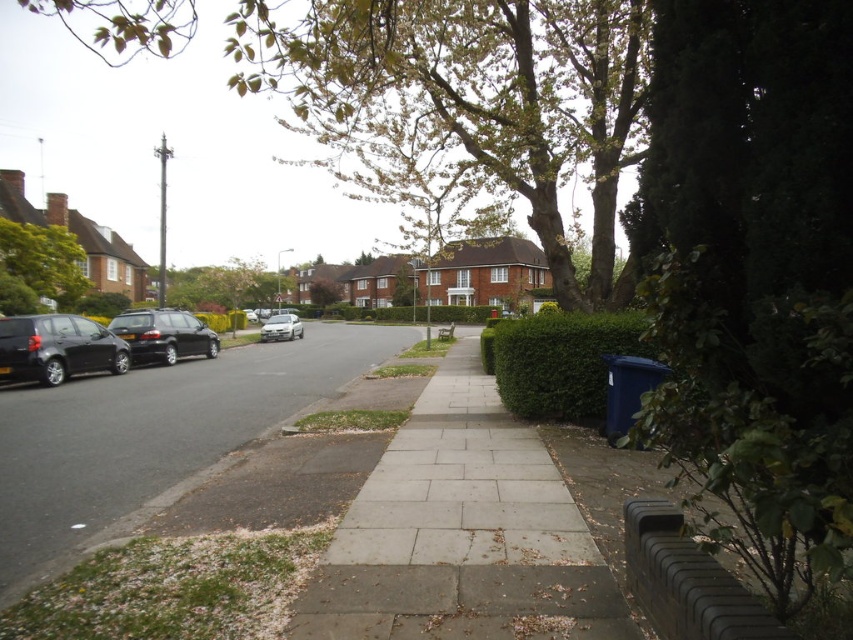
You are a delivery drone flying above a residential street. You need to land on the sidewalk near the green leafy tree at upper center. What are the coordinates where you should aim to land?

The green leafy tree at upper center is located at coordinates point (x=463, y=108), so you should aim to land there.

You are a delivery person trying to park your delivery van, which is 2 meters tall, in this residential area. You see the green leafy tree at upper center and the shiny black car at left. Based on their heights, can your van pass under the tree without hitting it?

The green leafy tree at upper center is taller than the shiny black car at left. Since the van is 2 meters tall, and the tree is taller than the car, it depends on the car height. However, without specific measurements, we cannot confirm if the van can pass safely. Please check the actual height of the tree before proceeding.